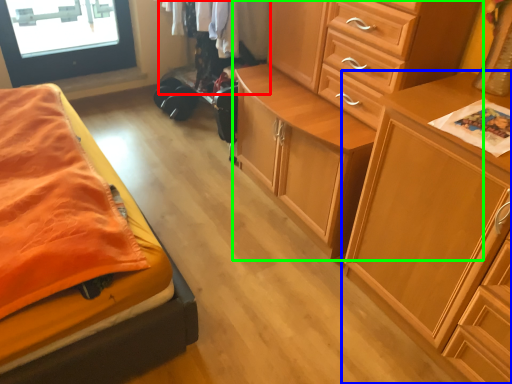
Question: Estimate the real-world distances between objects in this image. Which object is farther from clothing (highlighted by a red box), chest of drawers (highlighted by a blue box) or chest of drawers (highlighted by a green box)?

Choices:
 (A) chest of drawers
 (B) chest of drawers

Answer: (A)